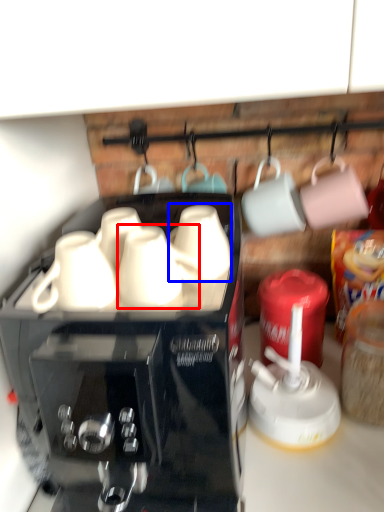
Question: Which of the following is the farthest to the observer, mug (highlighted by a red box) or mug (highlighted by a blue box)?

Choices:
 (A) mug
 (B) mug

Answer: (B)